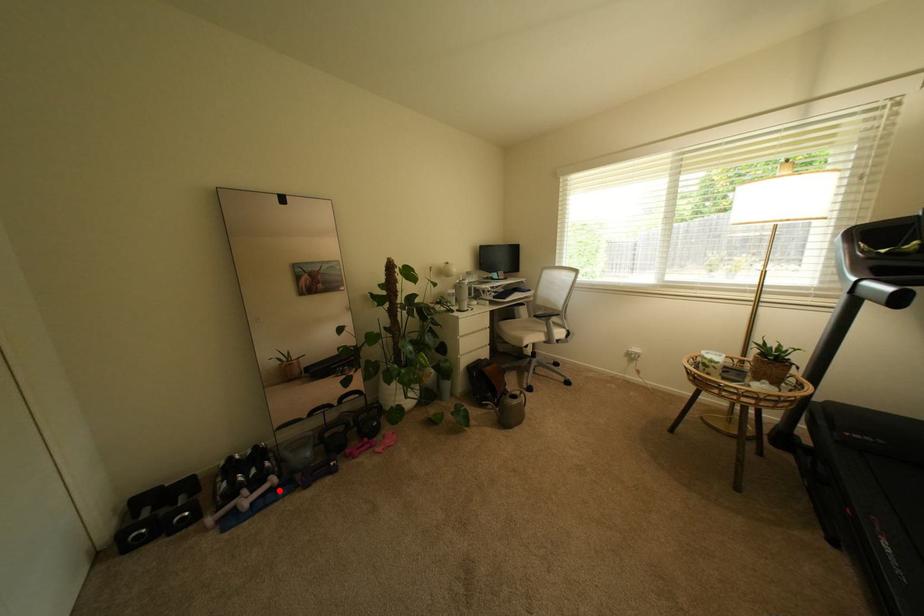
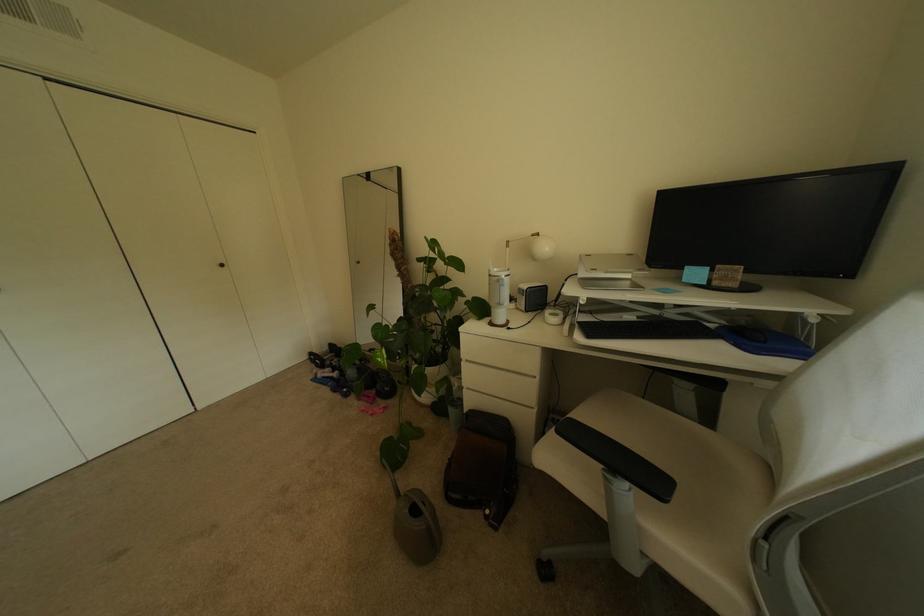
In the second image, find the point that corresponds to the highlighted location in the first image.

(341, 379)